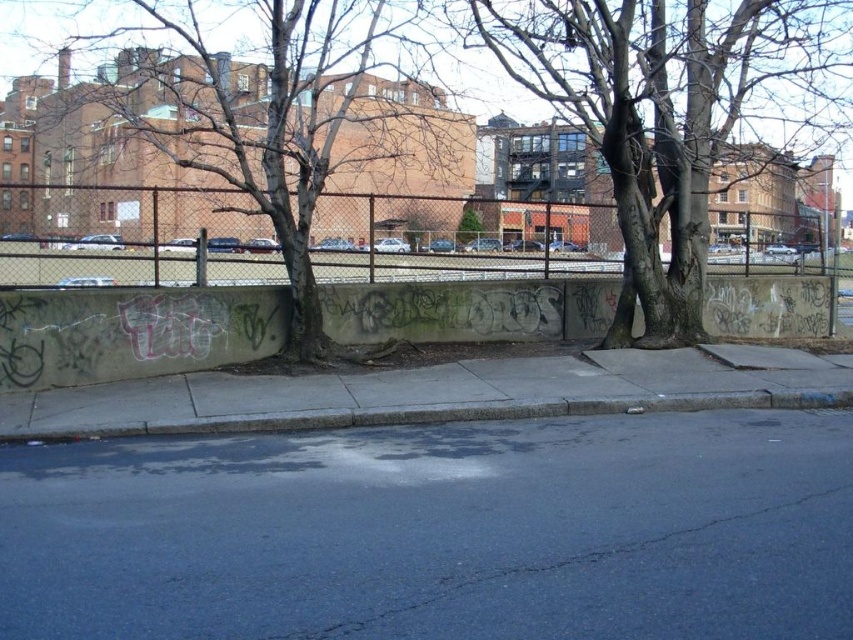
You are standing on the sidewalk next to the chain link fence. You want to walk to the bare wood tree at center. Which direction should you go?

The bare wood tree at center is located at point (660, 115), so you should walk towards the center of the image from your current position on the sidewalk next to the chain link fence.

You are standing at the point with coordinates point (24,504) and want to walk to point (659,340). Given the scene described, will you have to cross any obstacles like the road or sidewalk?

Since point (24,504) is in front of point (659,340), you would need to walk towards the back, potentially crossing the sidewalk and possibly the road, depending on their positions. However, the exact path isn

You are standing on the sidewalk and want to cross the road to reach the graffiti wall. There is a point marked at coordinates [438,531] on the road. Is this point on the asphalt pavement where you can safely step onto to cross?

The point at [438,531] is located on the dark asphalt pavement at lower center, which is part of the road. Since the road has visible cracks and patches and some areas are wet, it might not be the safest spot to cross. However, the specific point mentioned is on the asphalt pavement, so you can step there, but proceed with caution due to potential slippery or uneven surfaces.